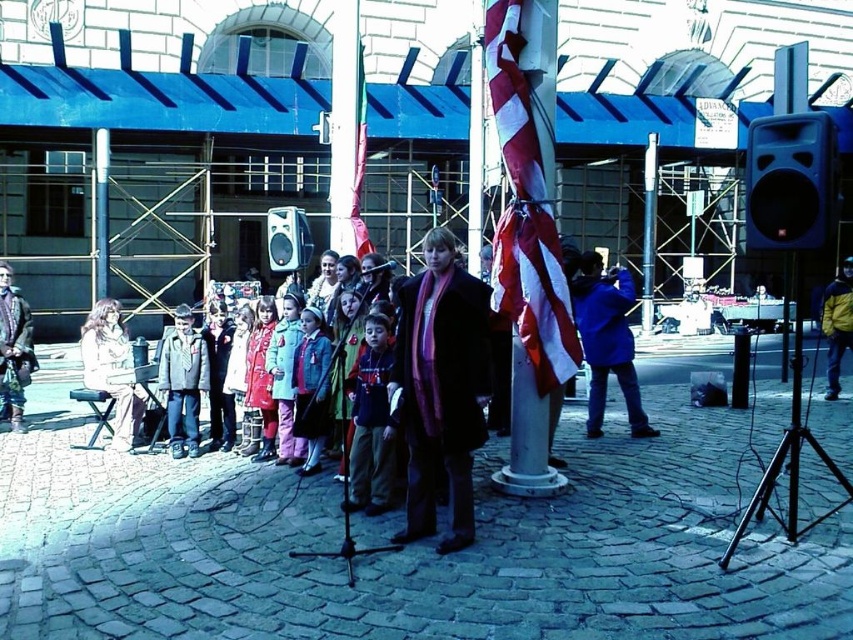
Question: Which object is farther from the camera taking this photo?

Choices:
 (A) american flag at center
 (B) denim jacket at center
 (C) matte white dress at left

Answer: (C)

Question: Does blue fabric jacket at right appear on the left side of matte black speaker at center?

Choices:
 (A) no
 (B) yes

Answer: (A)

Question: Which object is the farthest from the dark gray jacket at center?

Choices:
 (A) matte black speaker at center
 (B) purple wool scarf at center

Answer: (B)

Question: Does blue fabric jacket at right have a larger size compared to metallic pole at center?

Choices:
 (A) yes
 (B) no

Answer: (A)

Question: Can you confirm if metallic pole at center is thinner than red fabric flag at center?

Choices:
 (A) yes
 (B) no

Answer: (B)

Question: Which point is farther to the camera?

Choices:
 (A) (172, 384)
 (B) (409, 348)
 (C) (279, 381)
 (D) (764, 122)

Answer: (A)